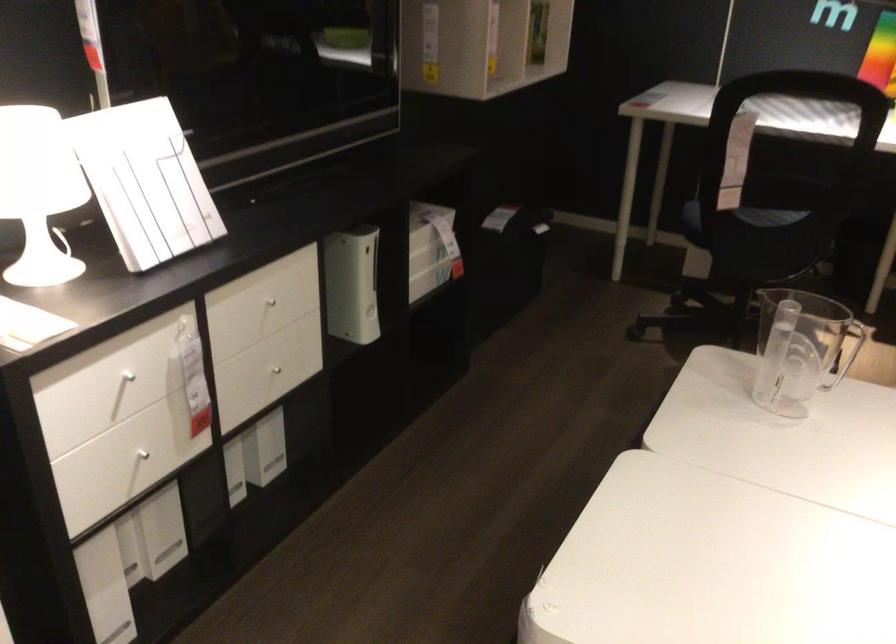
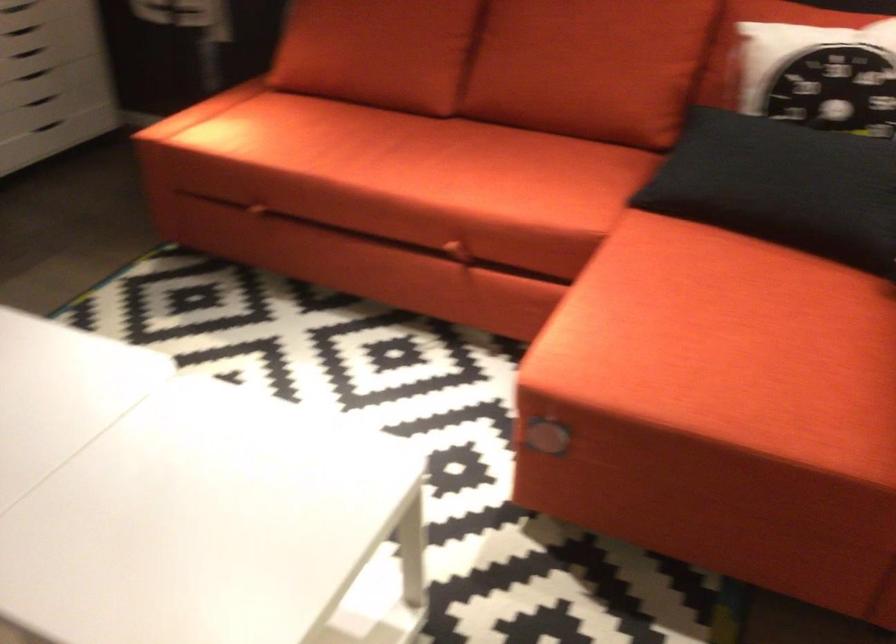
The images are taken continuously from a first-person perspective. In which direction is your viewpoint rotating?

The rotation direction of the camera is right-down.